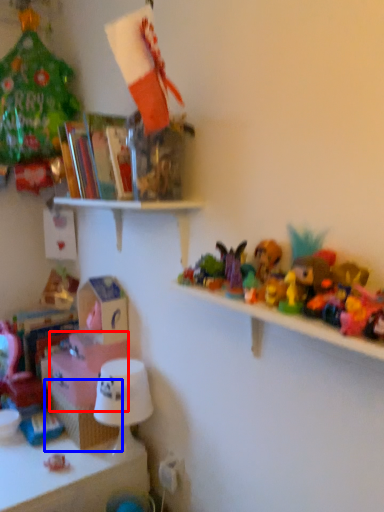
Question: Which object appears farthest to the camera in this image, box (highlighted by a red box) or shelf (highlighted by a blue box)?

Choices:
 (A) box
 (B) shelf

Answer: (A)